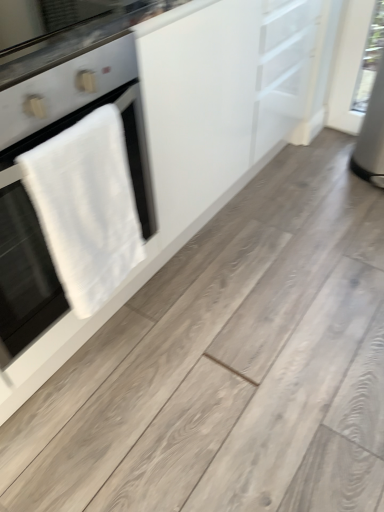
Question: From a real-world perspective, is white matte cabinet at upper left located higher than black glass countertop at upper left?

Choices:
 (A) yes
 (B) no

Answer: (B)

Question: From the image's perspective, would you say white matte cabinet at upper left is shown under black glass countertop at upper left?

Choices:
 (A) no
 (B) yes

Answer: (B)

Question: Is white matte cabinet at upper left bigger than black glass countertop at upper left?

Choices:
 (A) yes
 (B) no

Answer: (A)

Question: Is white matte cabinet at upper left facing towards black glass countertop at upper left?

Choices:
 (A) yes
 (B) no

Answer: (B)

Question: Is white matte cabinet at upper left taller than black glass countertop at upper left?

Choices:
 (A) no
 (B) yes

Answer: (B)

Question: From their relative heights in the image, would you say white towel at left is taller or shorter than white matte cabinet at upper left?

Choices:
 (A) tall
 (B) short

Answer: (A)

Question: From the image's perspective, relative to white matte cabinet at upper left, is white towel at left above or below?

Choices:
 (A) below
 (B) above

Answer: (B)

Question: Visually, is white towel at left positioned to the left or to the right of white matte cabinet at upper left?

Choices:
 (A) right
 (B) left

Answer: (B)

Question: Is white towel at left bigger or smaller than white matte cabinet at upper left?

Choices:
 (A) big
 (B) small

Answer: (A)

Question: Considering their positions, is white matte cabinet at upper left located in front of or behind black glass countertop at upper left?

Choices:
 (A) front
 (B) behind

Answer: (A)

Question: Considering the positions of point (1, 342) and point (59, 59), is point (1, 342) closer or farther from the camera than point (59, 59)?

Choices:
 (A) closer
 (B) farther

Answer: (B)

Question: In terms of height, does white matte cabinet at upper left look taller or shorter compared to black glass countertop at upper left?

Choices:
 (A) tall
 (B) short

Answer: (A)

Question: Is white matte cabinet at upper left bigger or smaller than black glass countertop at upper left?

Choices:
 (A) small
 (B) big

Answer: (B)

Question: From the image's perspective, is white towel at left located above or below black glass countertop at upper left?

Choices:
 (A) below
 (B) above

Answer: (A)

Question: In terms of height, does white towel at left look taller or shorter compared to black glass countertop at upper left?

Choices:
 (A) tall
 (B) short

Answer: (A)